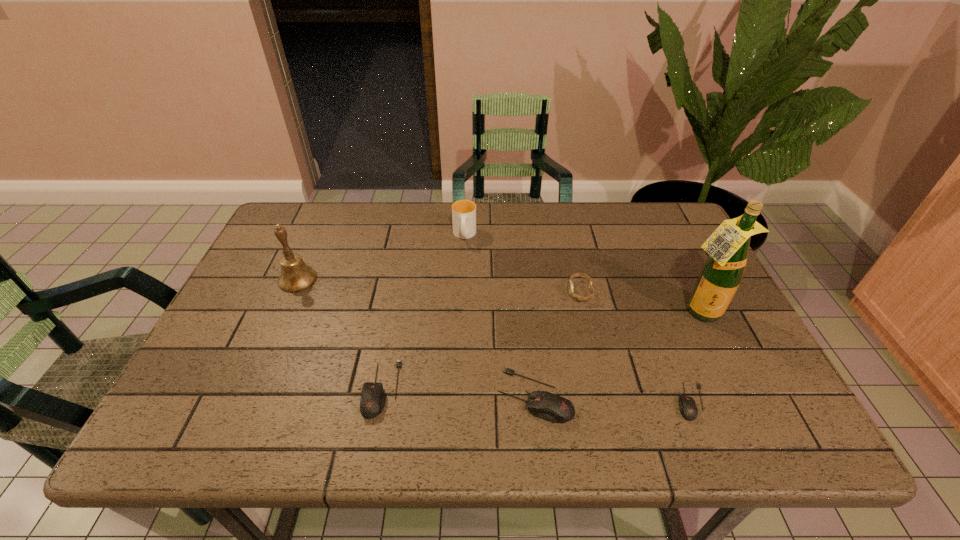
This screenshot has width=960, height=540. I want to click on blank area at the far left corner, so click(x=310, y=237).

Locate an element on the screen. vacant area that lies between the fourth object from right to left and the watch is located at coordinates (558, 343).

The image size is (960, 540). Identify the location of free spot between the watch and the cup. (522, 264).

I want to click on vacant space in between the rightmost object and the second object from left to right, so click(x=540, y=351).

Locate an element on the screen. Image resolution: width=960 pixels, height=540 pixels. free space between the cup and the fifth object from left to right is located at coordinates (522, 264).

Identify the location of free spot between the watch and the second mouse from right to left. This screenshot has height=540, width=960. (558, 343).

Locate an element on the screen. empty space between the fourth object from right to left and the third object from left to right is located at coordinates (499, 315).

The height and width of the screenshot is (540, 960). I want to click on free space between the leftmost mouse and the second mouse from left to right, so click(x=458, y=392).

This screenshot has height=540, width=960. Find the location of `vacant area between the second tallest mouse and the farthest object`. vacant area between the second tallest mouse and the farthest object is located at coordinates (422, 312).

The image size is (960, 540). In order to click on object that stands as the fourth closest to the sixth shortest object in this screenshot , I will do `click(570, 286)`.